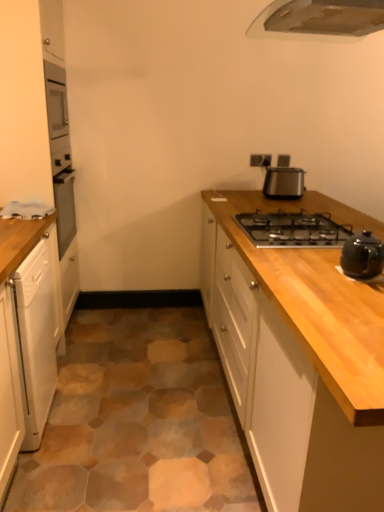
Question: Can you confirm if metallic stainless steel toaster at upper right, which is counted as the 2th kitchen appliance, starting from the front, is wider than black metallic gas stove at upper right?

Choices:
 (A) yes
 (B) no

Answer: (B)

Question: Is metallic stainless steel toaster at upper right, marked as the first kitchen appliance in a back-to-front arrangement, not within black metallic gas stove at upper right?

Choices:
 (A) no
 (B) yes

Answer: (B)

Question: Does metallic stainless steel toaster at upper right, which is the 1th kitchen appliance from top to bottom, have a lesser height compared to black metallic gas stove at upper right?

Choices:
 (A) yes
 (B) no

Answer: (B)

Question: Can you confirm if metallic stainless steel toaster at upper right, which is the 1th kitchen appliance from top to bottom, is bigger than black metallic gas stove at upper right?

Choices:
 (A) no
 (B) yes

Answer: (A)

Question: Is metallic stainless steel toaster at upper right, which is counted as the 2th kitchen appliance, starting from the front, next to black metallic gas stove at upper right?

Choices:
 (A) yes
 (B) no

Answer: (B)

Question: Does white glossy dishwasher at left, which ranks as the 2th cabinetry in right-to-left order, have a larger size compared to black metallic gas stove at upper right?

Choices:
 (A) yes
 (B) no

Answer: (A)

Question: Is white glossy dishwasher at left, which ranks as the 2th cabinetry in right-to-left order, turned away from black metallic gas stove at upper right?

Choices:
 (A) yes
 (B) no

Answer: (B)

Question: From a real-world perspective, is white glossy dishwasher at left, the 2th cabinetry in the left-to-right sequence, below black metallic gas stove at upper right?

Choices:
 (A) yes
 (B) no

Answer: (A)

Question: Would you say white glossy dishwasher at left, the 2th cabinetry in the left-to-right sequence, contains black metallic gas stove at upper right?

Choices:
 (A) no
 (B) yes

Answer: (A)

Question: Considering the relative sizes of white glossy dishwasher at left, which ranks as the 2th cabinetry in right-to-left order, and black metallic gas stove at upper right in the image provided, is white glossy dishwasher at left, which ranks as the 2th cabinetry in right-to-left order, smaller than black metallic gas stove at upper right?

Choices:
 (A) no
 (B) yes

Answer: (A)

Question: Is white glossy dishwasher at left, which ranks as the 2th cabinetry in right-to-left order, oriented towards black metallic gas stove at upper right?

Choices:
 (A) no
 (B) yes

Answer: (B)

Question: Considering the relative positions of metallic stainless steel toaster at upper right, which is the 1th kitchen appliance from top to bottom, and wooden cabinet at center, positioned as the first cabinetry in right-to-left order, in the image provided, is metallic stainless steel toaster at upper right, which is the 1th kitchen appliance from top to bottom, to the right of wooden cabinet at center, positioned as the first cabinetry in right-to-left order, from the viewer's perspective?

Choices:
 (A) no
 (B) yes

Answer: (B)